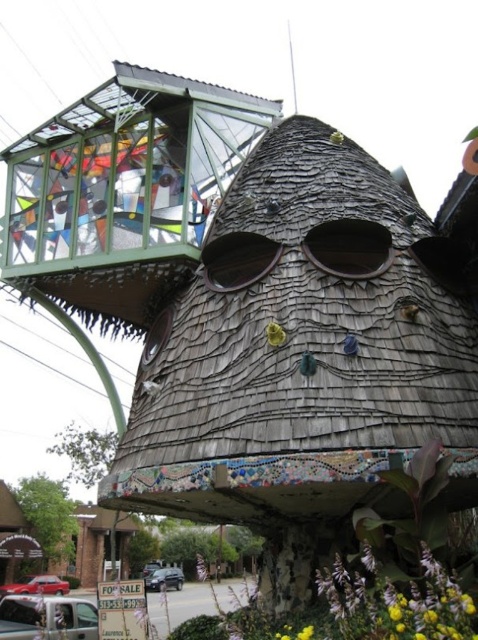
Question: Estimate the real-world distances between objects in this image. Which object is farther from the silver metallic van at lower left?

Choices:
 (A) shiny red sedan at lower left
 (B) wooden shingles at lower center
 (C) metallic silver car at lower center

Answer: (C)

Question: Can you confirm if wooden shingles at lower center is wider than shiny red sedan at lower left?

Choices:
 (A) yes
 (B) no

Answer: (A)

Question: Considering the relative positions of silver metallic van at lower left and shiny red sedan at lower left in the image provided, where is silver metallic van at lower left located with respect to shiny red sedan at lower left?

Choices:
 (A) above
 (B) below

Answer: (A)

Question: Which object appears closest to the camera in this image?

Choices:
 (A) metallic silver car at lower center
 (B) wooden shingles at lower center
 (C) silver metallic van at lower left

Answer: (C)

Question: Which object is farther from the camera taking this photo?

Choices:
 (A) wooden shingles at lower center
 (B) shiny red sedan at lower left

Answer: (B)

Question: Is wooden shingles at lower center below metallic silver car at lower center?

Choices:
 (A) no
 (B) yes

Answer: (A)